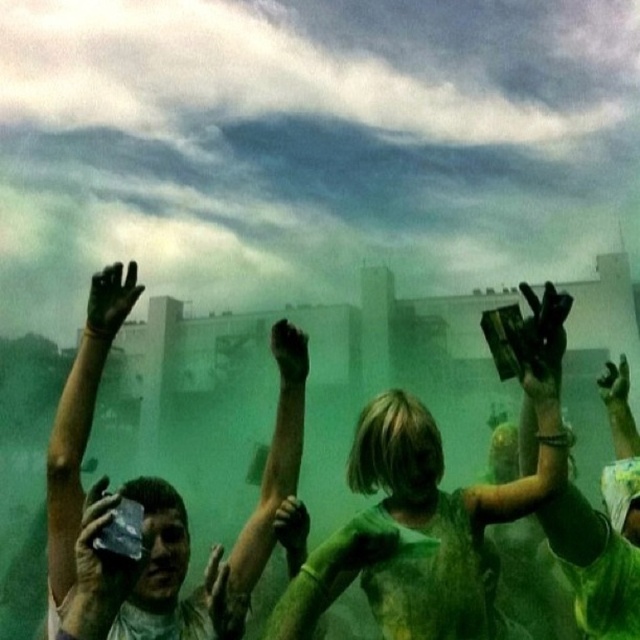
Between green matte/soft fabric at center and green painted hands at center, which one is positioned lower?

green matte/soft fabric at center is lower down.

Measure the distance between green matte/soft fabric at center and green painted hands at center.

A distance of 26.23 inches exists between green matte/soft fabric at center and green painted hands at center.

The height and width of the screenshot is (640, 640). What are the coordinates of `green matte/soft fabric at center` in the screenshot? It's located at (433, 506).

Find the location of a particular element. This screenshot has height=640, width=640. green matte/soft fabric at center is located at coordinates (433, 506).